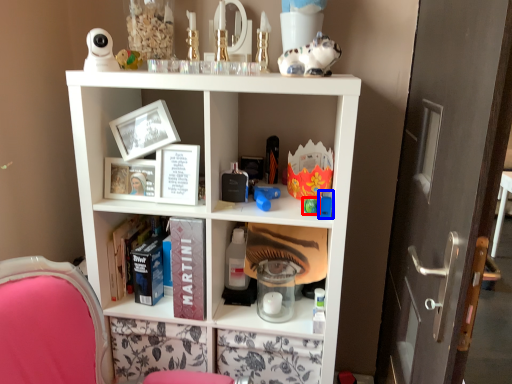
Question: Which of the following is the farthest to the observer, toy (highlighted by a red box) or toy (highlighted by a blue box)?

Choices:
 (A) toy
 (B) toy

Answer: (B)